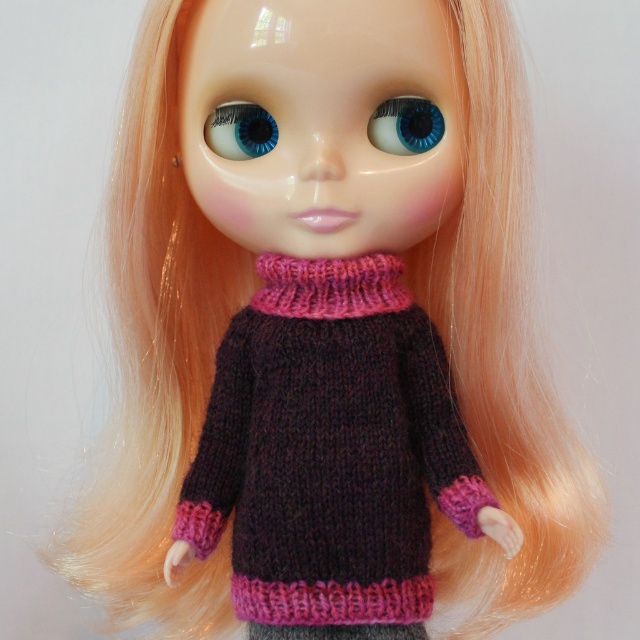
You are an appraiser examining the doll and need to determine the positioning of its eyes. Which of the blue glossy eye at center and blue glossy eye at upper center is positioned closer to you?

The blue glossy eye at center is positioned closer to the viewer than the blue glossy eye at upper center.

Consider the image. You are a toy designer examining the doll. You need to determine if the knitted dark purple sweater at center will cover the blue glossy eye at center. Based on their sizes, can the sweater potentially cover the eye?

The knitted dark purple sweater at center is much taller than the blue glossy eye at center, so yes, the sweater could potentially cover the eye if positioned correctly.